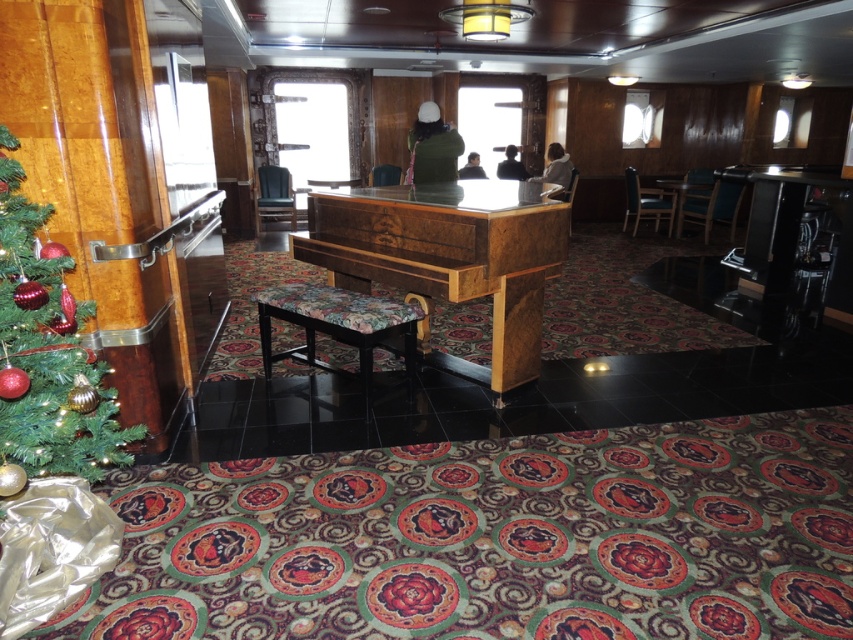
You are standing in the ship lounge and want to play the wooden piano at center. You see the point marked at coordinates (x=450, y=252). Is this point where the wooden piano is located?

Yes, the wooden piano at center is represented by point (x=450, y=252), so the point marked at coordinates (x=450, y=252) is indeed where the wooden piano is located.

You are a guest standing at the entrance of the ship lounge. You want to move from the entrance to the floral fabric stool at center. Is the green matte christmas tree at left in your way?

The green matte christmas tree at left is closer to the viewer than the floral fabric stool at center, so it is blocking your path to the floral fabric stool at center.

You are a guest in the ship lounge and want to take a photo of both the wooden piano at center and the green matte christmas tree at left. Which object should you focus on first if you want to capture both in the same frame without moving the camera?

The wooden piano at center is taller than the green matte christmas tree at left, so you should focus on the wooden piano at center first to ensure it fits within the frame.